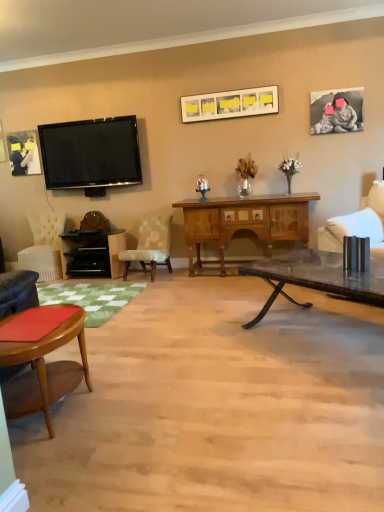
Image resolution: width=384 pixels, height=512 pixels. I want to click on free point above matte white picture frame at upper center, arranged as the 2th picture frame when viewed from the left (from a real-world perspective), so click(226, 92).